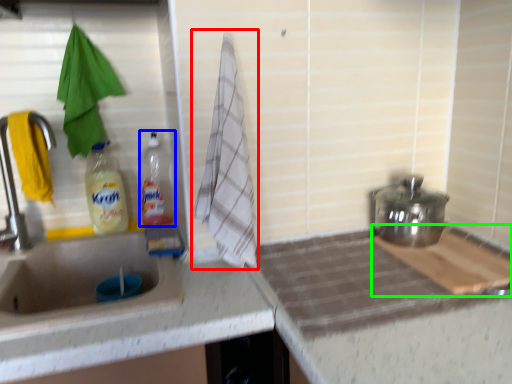
Question: Considering the real-world distances, which object is closest to beach towel (highlighted by a red box)? bottle (highlighted by a blue box) or cutting board (highlighted by a green box).

Choices:
 (A) bottle
 (B) cutting board

Answer: (A)